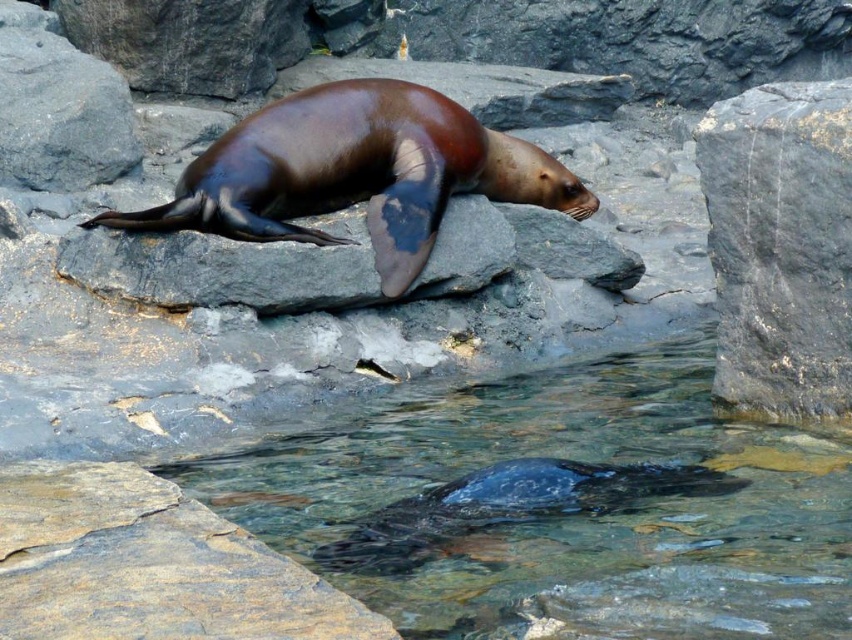
Based on the photo, does clear water at lower center appear on the left side of brown matte rock at center?

No, clear water at lower center is not to the left of brown matte rock at center.

How distant is clear water at lower center from brown matte rock at center?

clear water at lower center and brown matte rock at center are 1.27 meters apart.

This screenshot has height=640, width=852. I want to click on clear water at lower center, so click(x=557, y=508).

Which is more to the left, clear water at lower center or shiny brown seal at center?

From the viewer's perspective, shiny brown seal at center appears more on the left side.

Who is lower down, clear water at lower center or shiny brown seal at center?

clear water at lower center

Image resolution: width=852 pixels, height=640 pixels. What do you see at coordinates (557, 508) in the screenshot?
I see `clear water at lower center` at bounding box center [557, 508].

What are the coordinates of `clear water at lower center` in the screenshot? It's located at (557, 508).

Who is positioned more to the left, gray rough rock at center right or brown matte rock at center?

Positioned to the left is brown matte rock at center.

I want to click on gray rough rock at center right, so click(x=780, y=244).

Where is `gray rough rock at center right`? This screenshot has height=640, width=852. gray rough rock at center right is located at coordinates (780, 244).